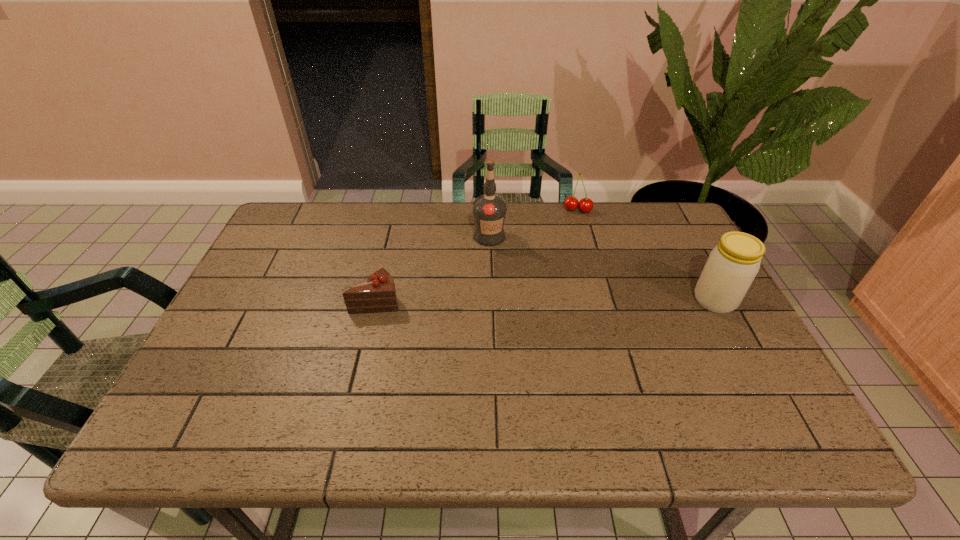
The image size is (960, 540). Identify the location of free spot on the desktop that is between the leftmost object and the third shortest object and is positioned with the stems of the second shortest object pointing upwards. (564, 300).

Where is `free space on the desktop that is between the chocolate cake and the third shortest object and is positioned on the front label of the tallest object`? free space on the desktop that is between the chocolate cake and the third shortest object and is positioned on the front label of the tallest object is located at coordinates pyautogui.click(x=556, y=300).